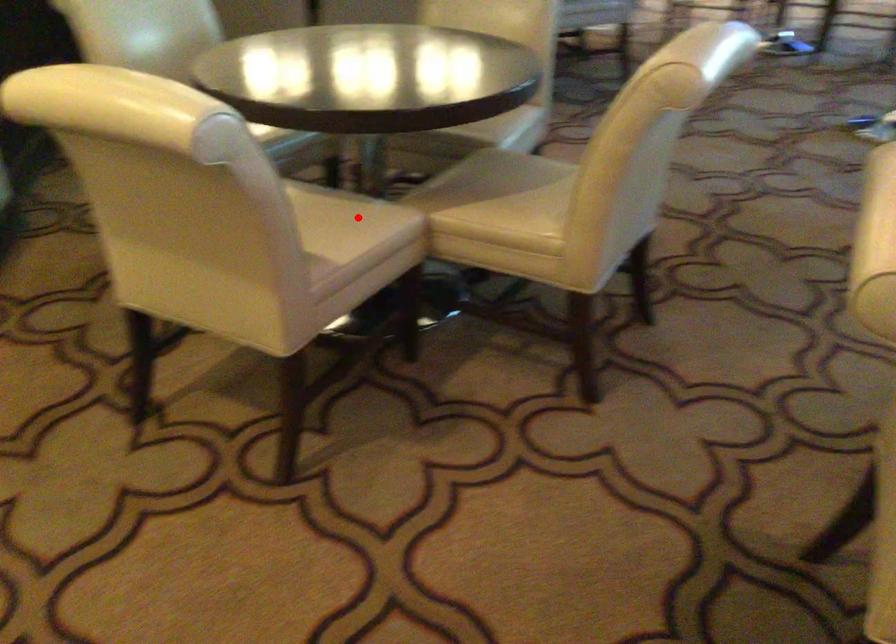
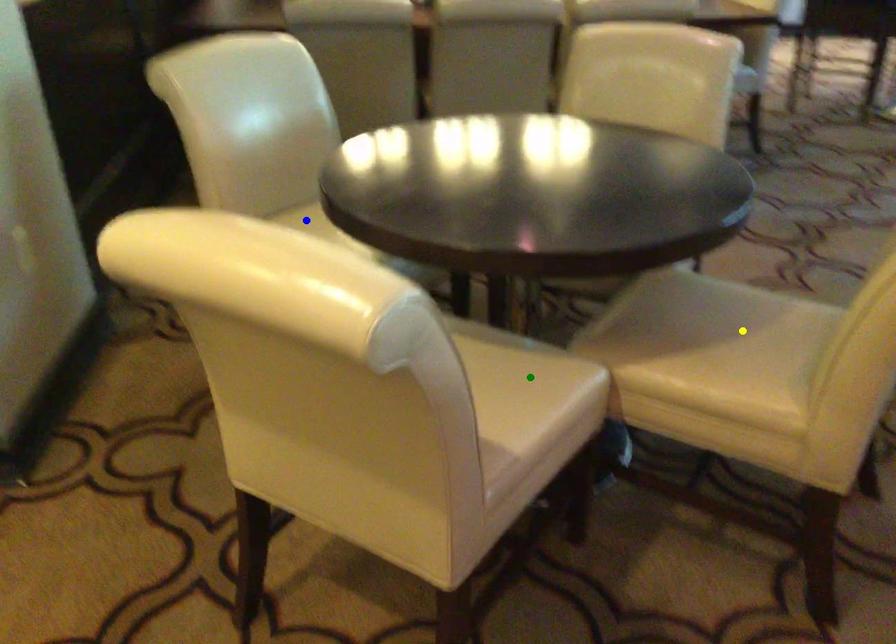
Question: I am providing you with two images of the same scene from different viewpoints. A red point is marked on the first image. You are given multiple points on the second image. In image 2, which mark is for the same physical point as the one in image 1?

Choices:
 (A) yellow point
 (B) green point
 (C) blue point

Answer: (B)